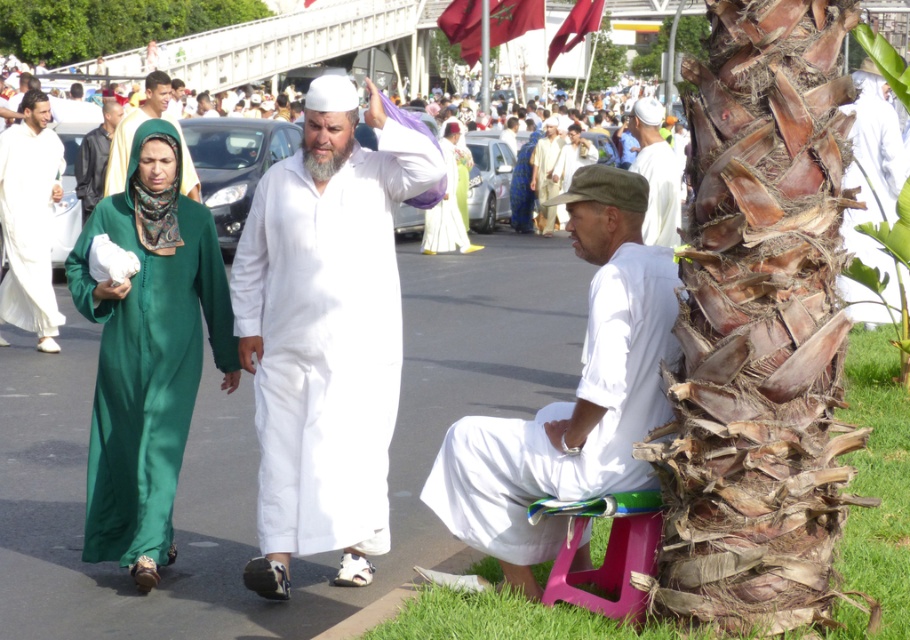
Question: Which object is the farthest from the white matte robe at left?

Choices:
 (A) white sheer dress at center
 (B) white cotton shirt at lower right

Answer: (B)

Question: Does white cotton shirt at lower right appear on the right side of green satin abaya at center?

Choices:
 (A) yes
 (B) no

Answer: (A)

Question: Does green satin abaya at center have a smaller size compared to pink plastic stool at lower right?

Choices:
 (A) no
 (B) yes

Answer: (A)

Question: In this image, where is green satin abaya at center located relative to pink plastic stool at lower right?

Choices:
 (A) left
 (B) right

Answer: (A)

Question: Among these points, which one is farthest from the camera?

Choices:
 (A) (595, 148)
 (B) (399, 301)

Answer: (A)

Question: Which point is farther from the camera taking this photo?

Choices:
 (A) (98, 179)
 (B) (541, 150)
 (C) (405, 129)

Answer: (B)